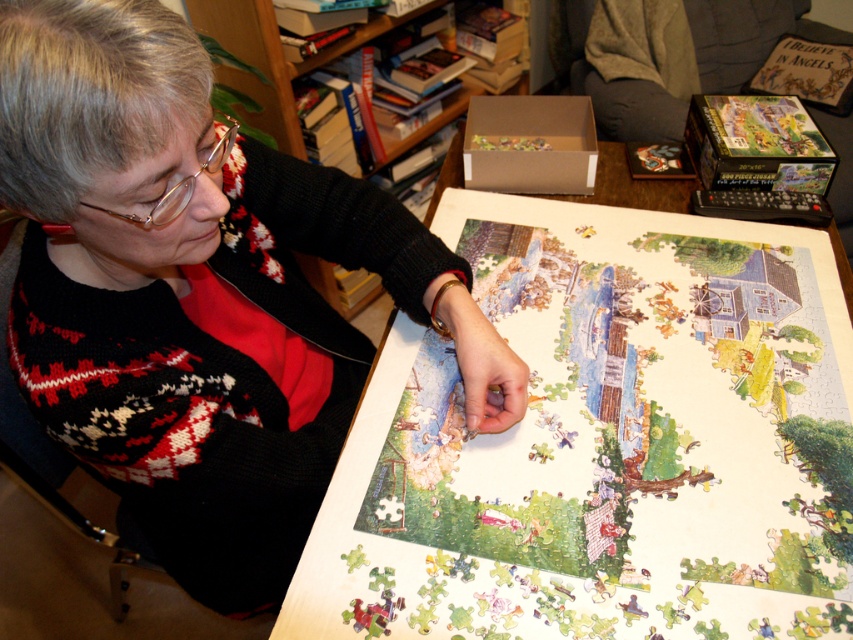
You are trying to place a large book on the table but need to make space. Which object between the white wood table at center and the knitted sweater at center should you move to create more space?

The knitted sweater at center should be moved because the white wood table at center is smaller in size, so moving the knitted sweater at center would free up more space.

You are a fashion designer analyzing the image. Where is the knitted sweater at center located in the image coordinates?

The knitted sweater at center is located at coordinates point (198, 292).